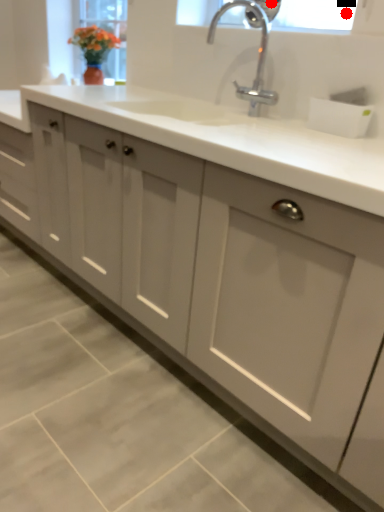
Question: Two points are circled on the image, labeled by A and B beside each circle. Which point appears closest to the camera in this image?

Choices:
 (A) A is closer
 (B) B is closer

Answer: (B)